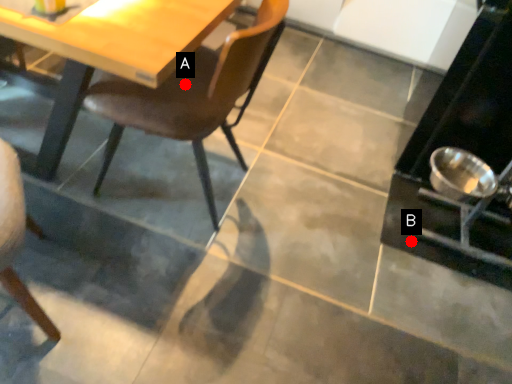
Question: Two points are circled on the image, labeled by A and B beside each circle. Which point appears closest to the camera in this image?

Choices:
 (A) A is closer
 (B) B is closer

Answer: (A)